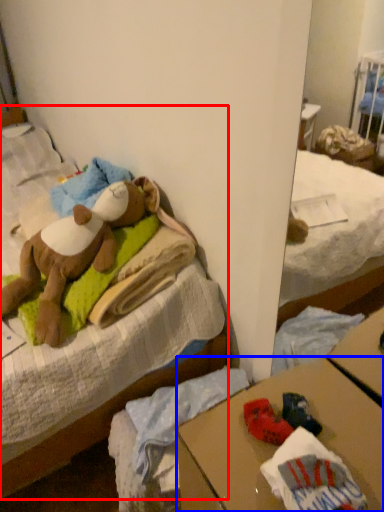
Question: Which point is further to the camera, bed (highlighted by a red box) or desk (highlighted by a blue box)?

Choices:
 (A) bed
 (B) desk

Answer: (A)